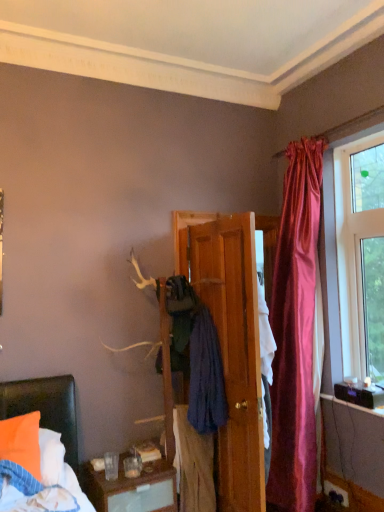
Question: Is wooden door at center to the left or to the right of clear glass window at upper right in the image?

Choices:
 (A) left
 (B) right

Answer: (A)

Question: Would you say wooden door at center is inside or outside clear glass window at upper right?

Choices:
 (A) inside
 (B) outside

Answer: (B)

Question: Which object is the farthest from the blue cotton towel at center, acting as the 1th clothing starting from the top?

Choices:
 (A) matte black speaker at lower right
 (B) wooden door at center
 (C) blue cotton sweater at center, the 1th clothing positioned from the bottom
 (D) clear glass window at upper right

Answer: (D)

Question: Considering the real-world distances, which object is closest to the blue cotton sweater at center, the 2th clothing in the top-to-bottom sequence?

Choices:
 (A) matte black speaker at lower right
 (B) blue cotton towel at center, acting as the second clothing starting from the bottom
 (C) clear glass window at upper right
 (D) wooden door at center

Answer: (B)